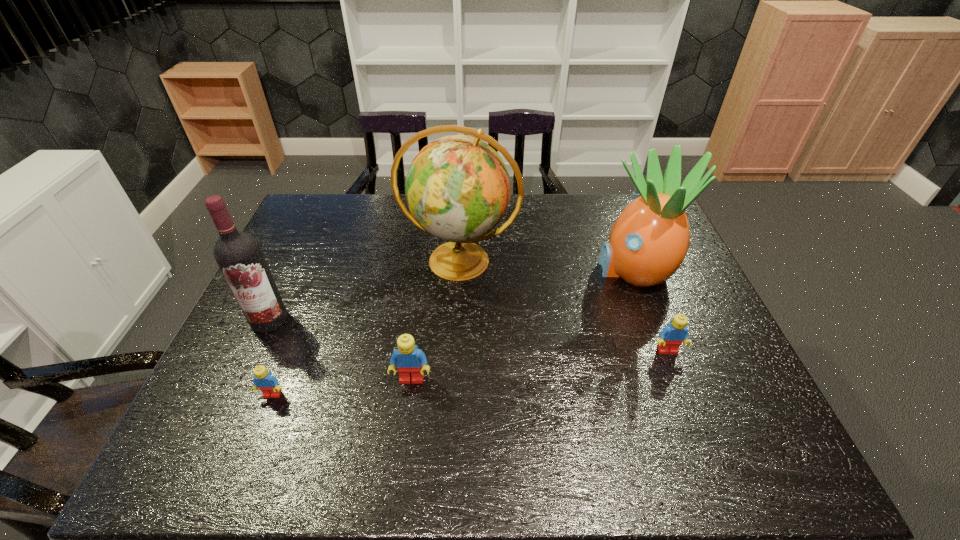
Select which Lego appears as the closest to the wine bottle. Please provide its 2D coordinates. Your answer should be formatted as a tuple, i.e. [(x, y)], where the tuple contains the x and y coordinates of a point satisfying the conditions above.

[(266, 382)]

The height and width of the screenshot is (540, 960). I want to click on Lego that is the second nearest to the fifth tallest object, so click(266, 382).

The image size is (960, 540). I want to click on free space that satisfies the following two spatial constraints: 1. at the entrance of the pineapple; 2. on the face of the nearest object, so click(x=681, y=395).